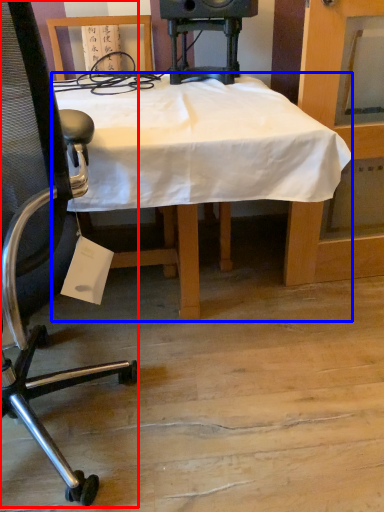
Question: Which object is further to the camera taking this photo, chair (highlighted by a red box) or desk (highlighted by a blue box)?

Choices:
 (A) chair
 (B) desk

Answer: (B)